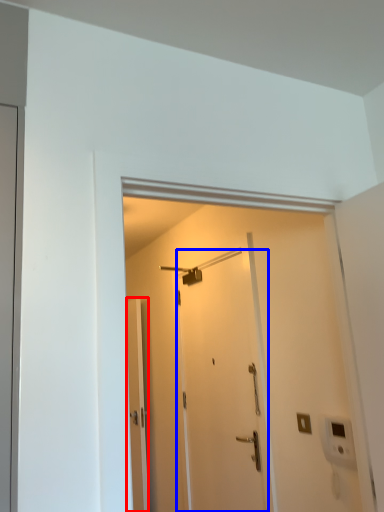
Question: Which object is further to the camera taking this photo, door (highlighted by a red box) or door (highlighted by a blue box)?

Choices:
 (A) door
 (B) door

Answer: (A)